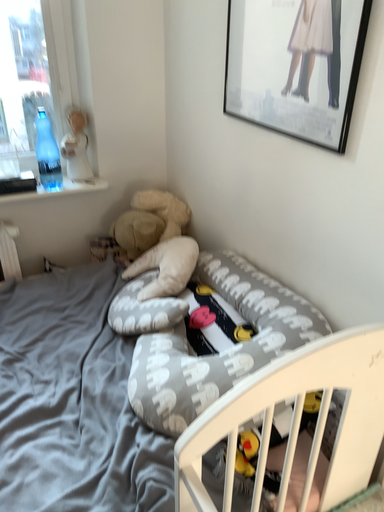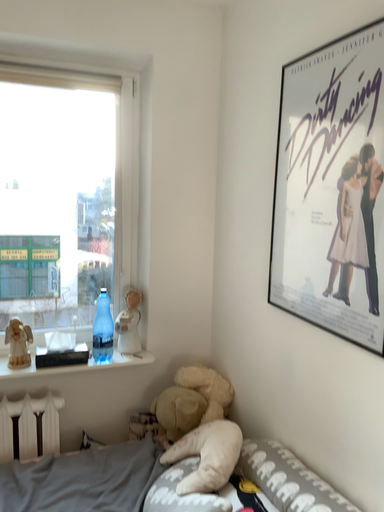
Question: How did the camera likely rotate when shooting the video?

Choices:
 (A) rotated upward
 (B) rotated downward

Answer: (A)